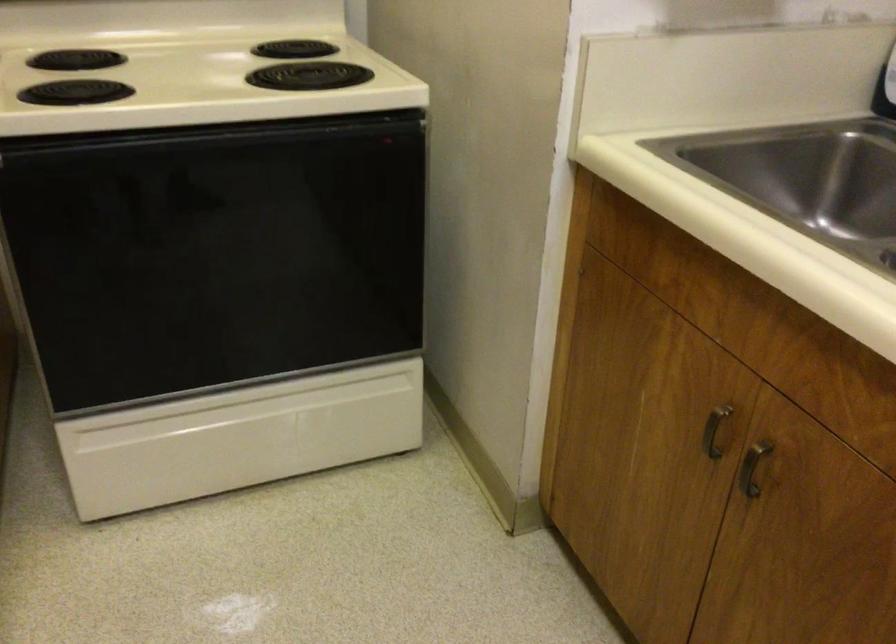
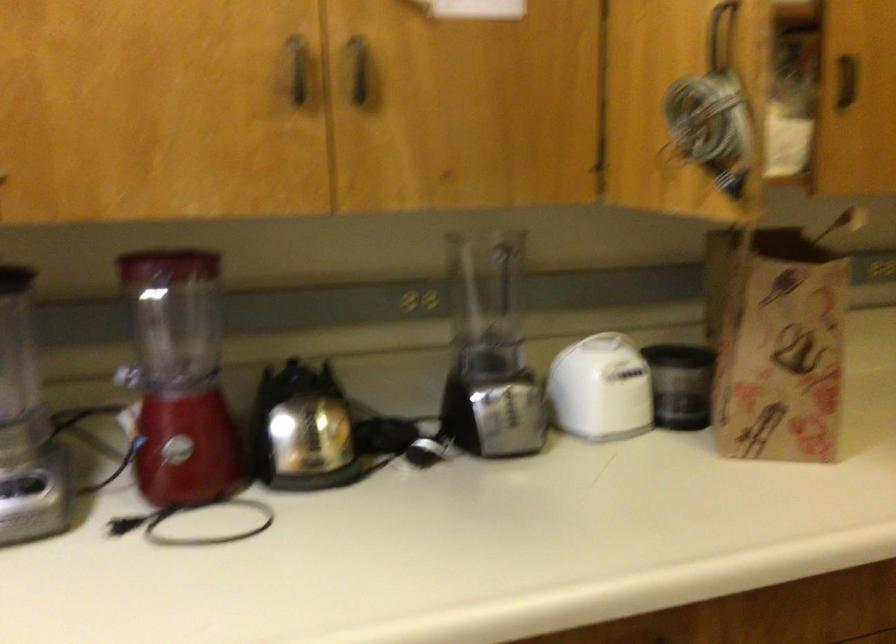
Question: The first image is from the beginning of the video and the second image is from the end. How did the camera likely rotate when shooting the video?

Choices:
 (A) Left
 (B) Right
 (C) Up
 (D) Down

Answer: (A)